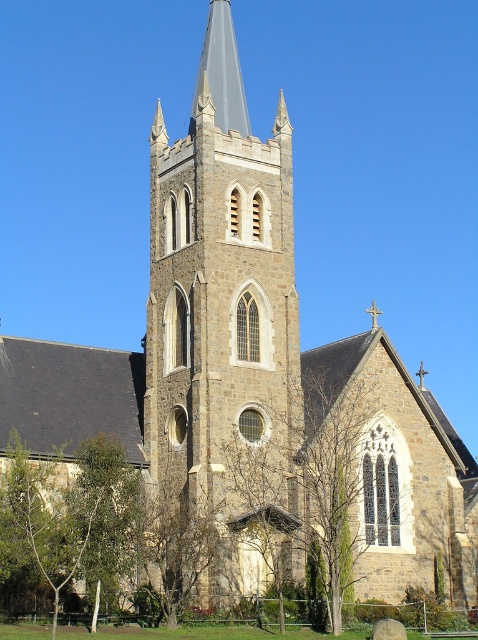
Question: Which object is the closest to the smooth gray steeple at center?

Choices:
 (A) brown textured tree at lower center
 (B) brown stone tower at center

Answer: (B)

Question: Does brown stone tower at center have a larger size compared to brown textured tree at lower center?

Choices:
 (A) no
 (B) yes

Answer: (B)

Question: Estimate the real-world distances between objects in this image. Which object is closer to the brown textured tree at lower center?

Choices:
 (A) brown stone tower at center
 (B) smooth gray steeple at center

Answer: (A)

Question: Considering the relative positions of brown stone tower at center and smooth gray steeple at center in the image provided, where is brown stone tower at center located with respect to smooth gray steeple at center?

Choices:
 (A) above
 (B) below

Answer: (B)

Question: Which point is farther to the camera?

Choices:
 (A) smooth gray steeple at center
 (B) brown stone tower at center

Answer: (A)

Question: Considering the relative positions of brown stone tower at center and smooth gray steeple at center in the image provided, where is brown stone tower at center located with respect to smooth gray steeple at center?

Choices:
 (A) right
 (B) left

Answer: (A)